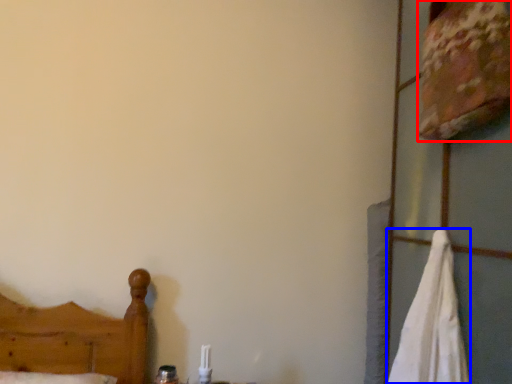
Question: Among these objects, which one is farthest to the camera, sheet (highlighted by a red box) or bath towel (highlighted by a blue box)?

Choices:
 (A) sheet
 (B) bath towel

Answer: (A)